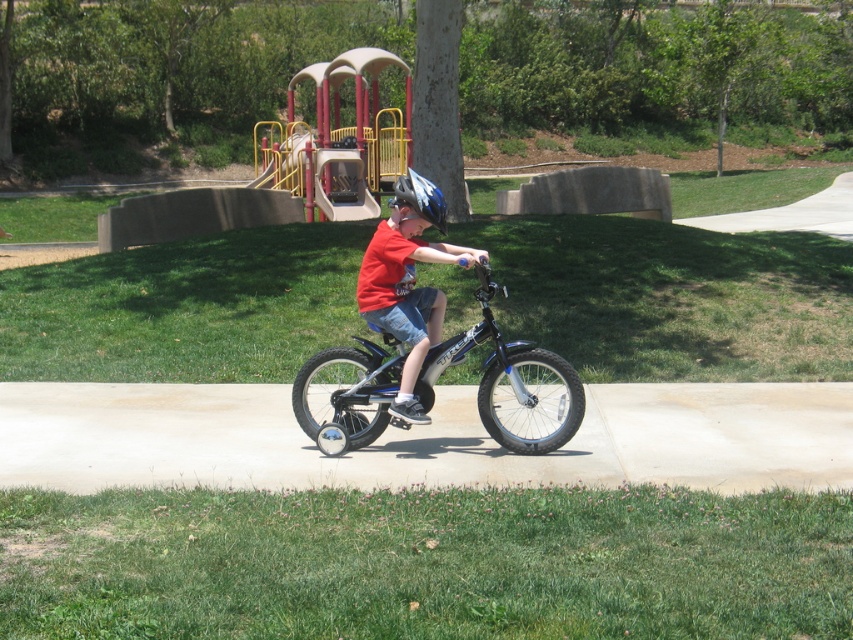
Question: Does smooth concrete pavement at center have a larger size compared to smooth plastic slide at upper center?

Choices:
 (A) yes
 (B) no

Answer: (B)

Question: Which object is positioned farthest from the matte red shirt at center?

Choices:
 (A) matte blue helmet at center
 (B) shiny metallic bicycle at center

Answer: (B)

Question: Which of the following is the closest to the observer?

Choices:
 (A) matte blue helmet at center
 (B) shiny metallic bicycle at center
 (C) smooth concrete pavement at center
 (D) smooth plastic slide at upper center

Answer: (C)

Question: Is shiny metallic bicycle at center thinner than matte blue helmet at center?

Choices:
 (A) no
 (B) yes

Answer: (A)

Question: Is smooth plastic slide at upper center smaller than matte red shirt at center?

Choices:
 (A) yes
 (B) no

Answer: (B)

Question: Which point is closer to the camera?

Choices:
 (A) (361, 112)
 (B) (434, 188)
 (C) (457, 448)

Answer: (B)